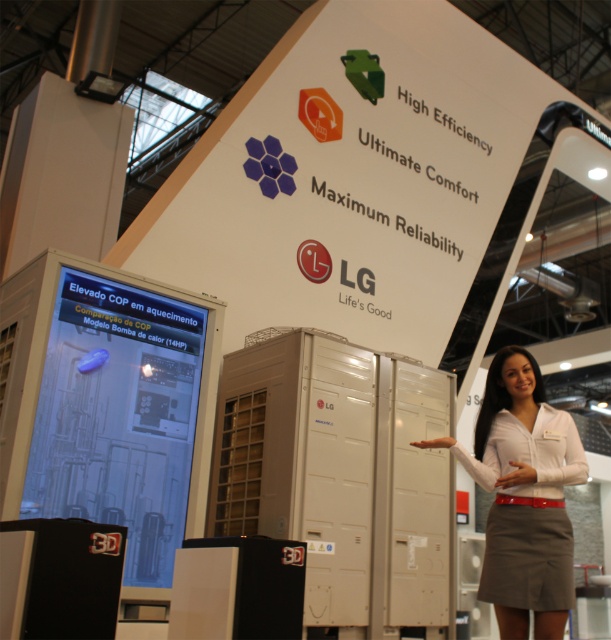
Is white paper at upper center below white fabric shirt at center?

No.

Between white paper at upper center and white fabric shirt at center, which one has less height?

Standing shorter between the two is white fabric shirt at center.

Locate an element on the screen. This screenshot has width=611, height=640. white paper at upper center is located at coordinates (351, 179).